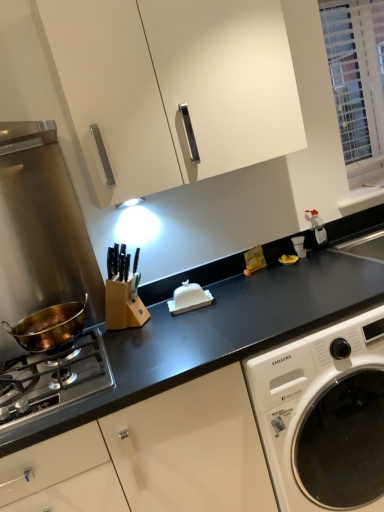
Question: Does bronze metallic wok at left have a larger size compared to white glossy butter dish at center?

Choices:
 (A) yes
 (B) no

Answer: (A)

Question: Would you say bronze metallic wok at left is outside white glossy butter dish at center?

Choices:
 (A) no
 (B) yes

Answer: (B)

Question: Considering the relative sizes of bronze metallic wok at left and white glossy butter dish at center in the image provided, is bronze metallic wok at left taller than white glossy butter dish at center?

Choices:
 (A) yes
 (B) no

Answer: (A)

Question: Are bronze metallic wok at left and white glossy butter dish at center located far from each other?

Choices:
 (A) yes
 (B) no

Answer: (B)

Question: From the image's perspective, is bronze metallic wok at left on top of white glossy butter dish at center?

Choices:
 (A) no
 (B) yes

Answer: (A)

Question: From the image's perspective, is white glossy butter dish at center positioned above or below white matte cabinet at upper center?

Choices:
 (A) below
 (B) above

Answer: (A)

Question: Would you say white glossy butter dish at center is inside or outside white matte cabinet at upper center?

Choices:
 (A) inside
 (B) outside

Answer: (B)

Question: From a real-world perspective, is white glossy butter dish at center positioned above or below white matte cabinet at upper center?

Choices:
 (A) above
 (B) below

Answer: (B)

Question: Would you say white glossy butter dish at center is to the left or to the right of white matte cabinet at upper center in the picture?

Choices:
 (A) right
 (B) left

Answer: (A)

Question: Considering the positions of point (1, 399) and point (192, 40), is point (1, 399) closer or farther from the camera than point (192, 40)?

Choices:
 (A) closer
 (B) farther

Answer: (A)

Question: Do you think bronze metallic pan at lower left is within white matte cabinet at upper center, or outside of it?

Choices:
 (A) inside
 (B) outside

Answer: (B)

Question: Considering the positions of bronze metallic pan at lower left and white matte cabinet at upper center in the image, is bronze metallic pan at lower left taller or shorter than white matte cabinet at upper center?

Choices:
 (A) tall
 (B) short

Answer: (B)

Question: Is bronze metallic pan at lower left bigger or smaller than white matte cabinet at upper center?

Choices:
 (A) big
 (B) small

Answer: (B)

Question: In terms of height, does white textured blinds at upper right look taller or shorter compared to bronze metallic wok at left?

Choices:
 (A) short
 (B) tall

Answer: (B)

Question: Is white textured blinds at upper right in front of or behind bronze metallic wok at left in the image?

Choices:
 (A) behind
 (B) front

Answer: (A)